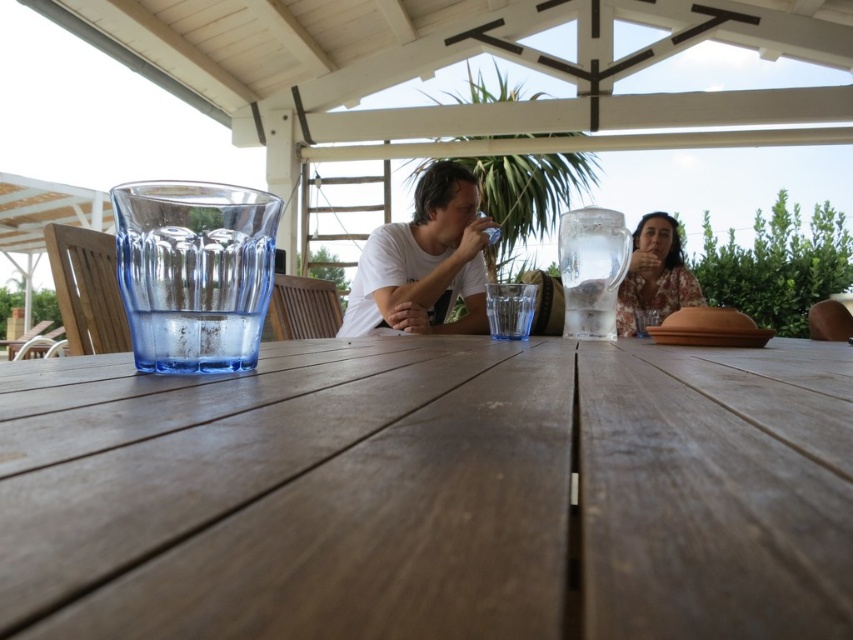
Who is more distant from viewer, (592, 298) or (677, 243)?

Positioned behind is point (677, 243).

From the picture: Which is more to the left, clear glass pitcher at upper right or floral fabric blouse at upper right?

Positioned to the left is clear glass pitcher at upper right.

Who is more distant from viewer, [590,268] or [631,307]?

Positioned behind is point [631,307].

Identify the location of clear glass pitcher at upper right. (590, 269).

Who is taller, brown wooden table at center or clear glass pitcher at upper right?

clear glass pitcher at upper right

Is point (717, 550) closer to viewer compared to point (567, 292)?

Yes, point (717, 550) is in front of point (567, 292).

Identify the location of brown wooden table at center. The image size is (853, 640). (431, 492).

Is point (479, 230) positioned in front of point (677, 273)?

Yes, it is.

Describe the element at coordinates (424, 260) in the screenshot. The image size is (853, 640). I see `white matte t-shirt at center` at that location.

This screenshot has width=853, height=640. Identify the location of white matte t-shirt at center. (424, 260).